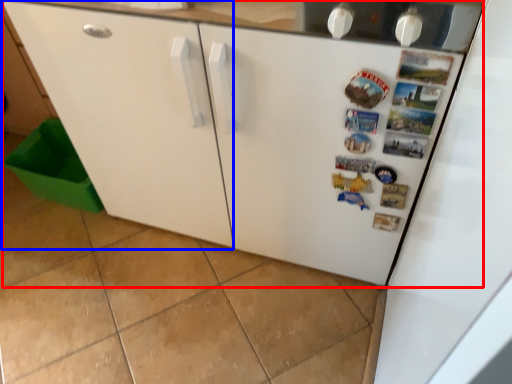
Question: Which of the following is the closest to the observer, refrigerator (highlighted by a red box) or cabinetry (highlighted by a blue box)?

Choices:
 (A) refrigerator
 (B) cabinetry

Answer: (B)